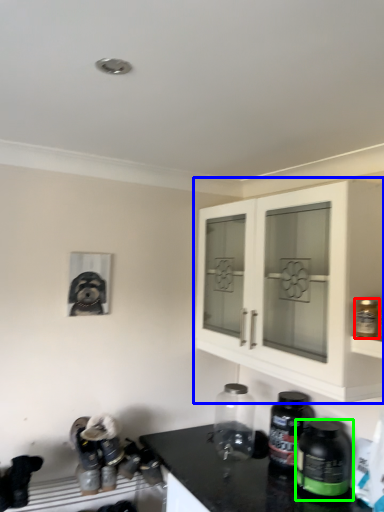
Question: Which object is the closest to the bottle (highlighted by a red box)? Choose among these: cabinetry (highlighted by a blue box) or bottle (highlighted by a green box).

Choices:
 (A) cabinetry
 (B) bottle

Answer: (A)